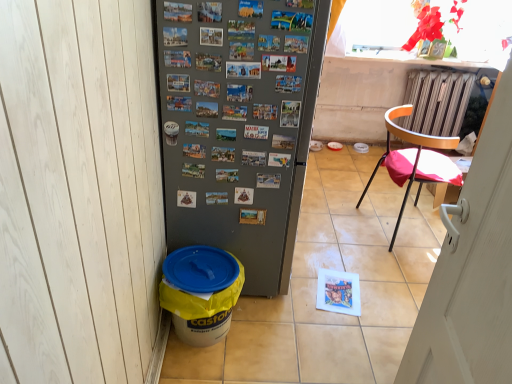
Question: Is orange plastic chair at right thinner than translucent plastic window screen at upper right?

Choices:
 (A) yes
 (B) no

Answer: (B)

Question: Can you confirm if orange plastic chair at right is taller than translucent plastic window screen at upper right?

Choices:
 (A) yes
 (B) no

Answer: (A)

Question: From the image's perspective, is orange plastic chair at right over translucent plastic window screen at upper right?

Choices:
 (A) no
 (B) yes

Answer: (A)

Question: Can you confirm if orange plastic chair at right is smaller than translucent plastic window screen at upper right?

Choices:
 (A) no
 (B) yes

Answer: (A)

Question: Considering the relative positions of orange plastic chair at right and translucent plastic window screen at upper right in the image provided, is orange plastic chair at right to the left of translucent plastic window screen at upper right from the viewer's perspective?

Choices:
 (A) no
 (B) yes

Answer: (A)

Question: Is orange plastic chair at right turned away from translucent plastic window screen at upper right?

Choices:
 (A) yes
 (B) no

Answer: (B)

Question: Considering the relative sizes of translucent plastic window screen at upper right and orange plastic chair at right in the image provided, is translucent plastic window screen at upper right taller than orange plastic chair at right?

Choices:
 (A) no
 (B) yes

Answer: (A)

Question: Does translucent plastic window screen at upper right have a larger size compared to orange plastic chair at right?

Choices:
 (A) yes
 (B) no

Answer: (B)

Question: Is orange plastic chair at right surrounded by translucent plastic window screen at upper right?

Choices:
 (A) no
 (B) yes

Answer: (A)

Question: Is translucent plastic window screen at upper right touching orange plastic chair at right?

Choices:
 (A) yes
 (B) no

Answer: (B)

Question: Does translucent plastic window screen at upper right lie behind orange plastic chair at right?

Choices:
 (A) yes
 (B) no

Answer: (B)

Question: From the image's perspective, does translucent plastic window screen at upper right appear higher than orange plastic chair at right?

Choices:
 (A) no
 (B) yes

Answer: (B)

Question: Is yellow plastic bucket at lower left not near orange plastic chair at right?

Choices:
 (A) no
 (B) yes

Answer: (B)